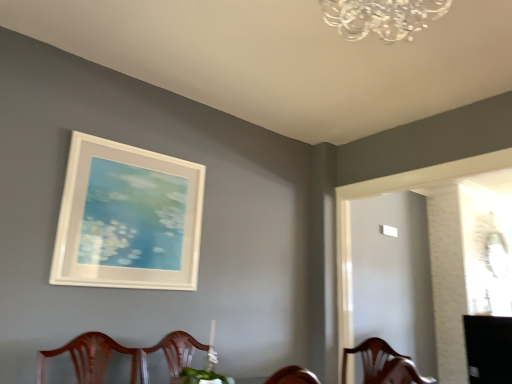
Find the location of a particular element. Image resolution: width=512 pixels, height=384 pixels. white matte picture frame at upper center is located at coordinates (128, 218).

What do you see at coordinates (128, 218) in the screenshot? I see `white matte picture frame at upper center` at bounding box center [128, 218].

What is the approximate width of white matte picture frame at upper center?

The width of white matte picture frame at upper center is 1.56 inches.

What is the approximate height of white matte picture frame at upper center?

It is 80.42 centimeters.

What do you see at coordinates (488, 349) in the screenshot?
I see `black glossy table at lower right` at bounding box center [488, 349].

Measure the distance between point [498,357] and camera.

They are 4.30 meters apart.

What are the coordinates of `black glossy table at lower right` in the screenshot? It's located at (488, 349).

This screenshot has width=512, height=384. What are the coordinates of `white matte picture frame at upper center` in the screenshot? It's located at (128, 218).

Is black glossy table at lower right to the left or to the right of white matte picture frame at upper center in the image?

black glossy table at lower right is positioned on white matte picture frame at upper center's right side.

Is black glossy table at lower right in front of or behind white matte picture frame at upper center in the image?

Clearly, black glossy table at lower right is behind white matte picture frame at upper center.

Considering the points (499, 320) and (163, 225), which point is behind, point (499, 320) or point (163, 225)?

The point (499, 320) is behind.

From the image's perspective, is black glossy table at lower right on top of white matte picture frame at upper center?

No.

From a real-world perspective, which object stands above the other?

white matte picture frame at upper center is physically above.

Can you confirm if black glossy table at lower right is wider than white matte picture frame at upper center?

Indeed, black glossy table at lower right has a greater width compared to white matte picture frame at upper center.

Which of these two, black glossy table at lower right or white matte picture frame at upper center, stands shorter?

black glossy table at lower right.

Is black glossy table at lower right bigger or smaller than white matte picture frame at upper center?

Considering their sizes, black glossy table at lower right takes up more space than white matte picture frame at upper center.

Is black glossy table at lower right spatially inside white matte picture frame at upper center, or outside of it?

black glossy table at lower right is located beyond the bounds of white matte picture frame at upper center.

Is the surface of black glossy table at lower right in direct contact with white matte picture frame at upper center?

black glossy table at lower right and white matte picture frame at upper center are not in contact.

Is black glossy table at lower right turned away from white matte picture frame at upper center?

Yes, black glossy table at lower right is positioned with its back facing white matte picture frame at upper center.

What's the angular difference between black glossy table at lower right and white matte picture frame at upper center's facing directions?

59.4 degrees separate the facing orientations of black glossy table at lower right and white matte picture frame at upper center.

At what (x,y) coordinates should I click in order to perform the action: click on table below the white matte picture frame at upper center (from a real-world perspective). Please return your answer as a coordinate pair (x, y). Looking at the image, I should click on (488, 349).

Between white matte picture frame at upper center and black glossy table at lower right, which one appears on the left side from the viewer's perspective?

white matte picture frame at upper center.

From the picture: Considering the positions of objects white matte picture frame at upper center and black glossy table at lower right in the image provided, who is behind, white matte picture frame at upper center or black glossy table at lower right?

black glossy table at lower right.

Considering the points (164, 237) and (510, 334), which point is in front, point (164, 237) or point (510, 334)?

The point (164, 237) is closer to the camera.

From the image's perspective, is white matte picture frame at upper center beneath black glossy table at lower right?

No.

From a real-world perspective, which object rests below the other?

black glossy table at lower right is physically lower.

Which of these two, white matte picture frame at upper center or black glossy table at lower right, is wider?

With larger width is black glossy table at lower right.

Considering the relative sizes of white matte picture frame at upper center and black glossy table at lower right in the image provided, is white matte picture frame at upper center shorter than black glossy table at lower right?

Incorrect, the height of white matte picture frame at upper center does not fall short of that of black glossy table at lower right.

Based on their sizes in the image, would you say white matte picture frame at upper center is bigger or smaller than black glossy table at lower right?

Clearly, white matte picture frame at upper center is smaller in size than black glossy table at lower right.

Is white matte picture frame at upper center completely or partially outside of black glossy table at lower right?

Absolutely, white matte picture frame at upper center is external to black glossy table at lower right.

Based on the photo, is white matte picture frame at upper center touching black glossy table at lower right?

No, white matte picture frame at upper center is not in contact with black glossy table at lower right.

Is white matte picture frame at upper center oriented towards black glossy table at lower right?

No, white matte picture frame at upper center is not aimed at black glossy table at lower right.

Locate an element on the screen. The height and width of the screenshot is (384, 512). table on the right of white matte picture frame at upper center is located at coordinates (488, 349).

Image resolution: width=512 pixels, height=384 pixels. What are the coordinates of `table located on the right of white matte picture frame at upper center` in the screenshot? It's located at (488, 349).

Where is `picture frame above the black glossy table at lower right (from the image's perspective)`? The height and width of the screenshot is (384, 512). picture frame above the black glossy table at lower right (from the image's perspective) is located at coordinates (128, 218).